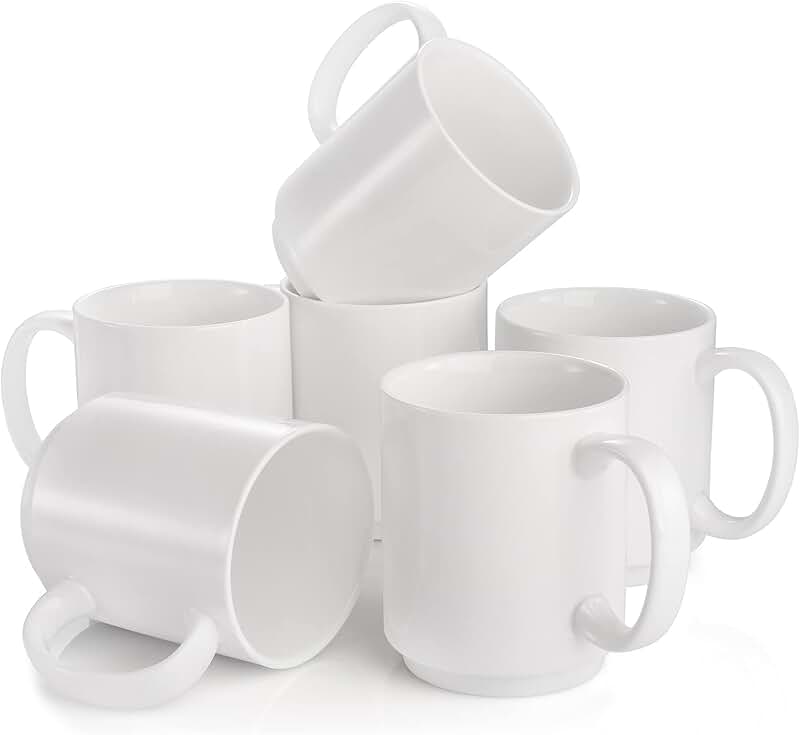
Where is `handle`? This screenshot has height=735, width=800. handle is located at coordinates (16, 379), (150, 689), (669, 514), (780, 404), (338, 54).